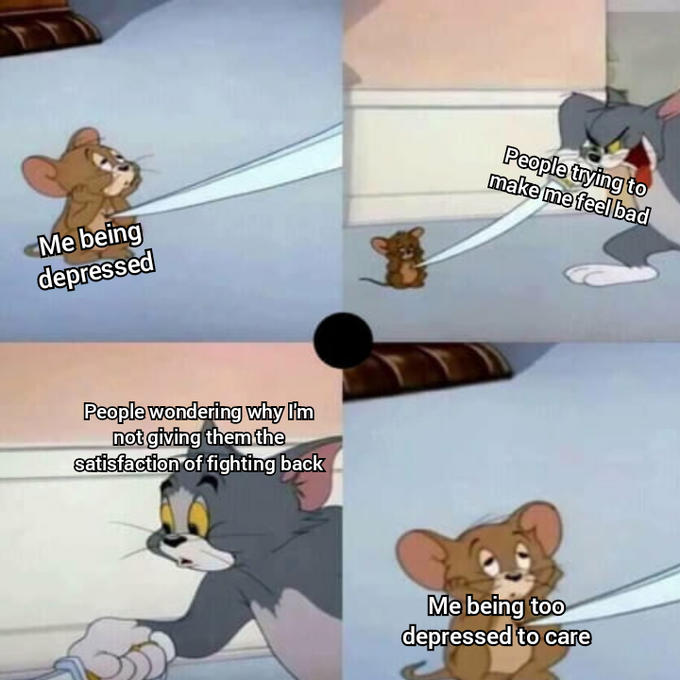
Find the location of `wall`. wall is located at coordinates (466, 51).